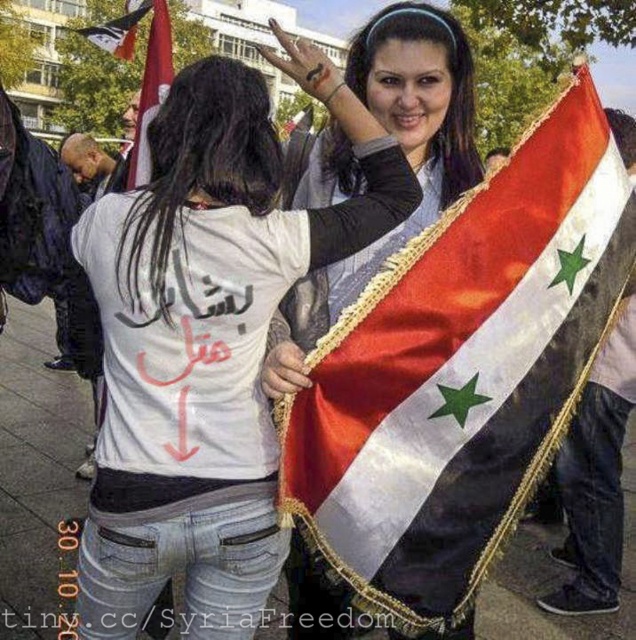
You are a photographer trying to capture the two flags in the scene. Which flag, the silky fabric flag at upper right or the red fabric flag at upper left, would appear taller in your photo?

The silky fabric flag at upper right has a greater height compared to the red fabric flag at upper left, so it would appear taller in the photo.

What is the color of the area where the point at coordinates (205, 346) is located?

The point at coordinates (205, 346) is located on the white matte t shirt at center, so the color is white.